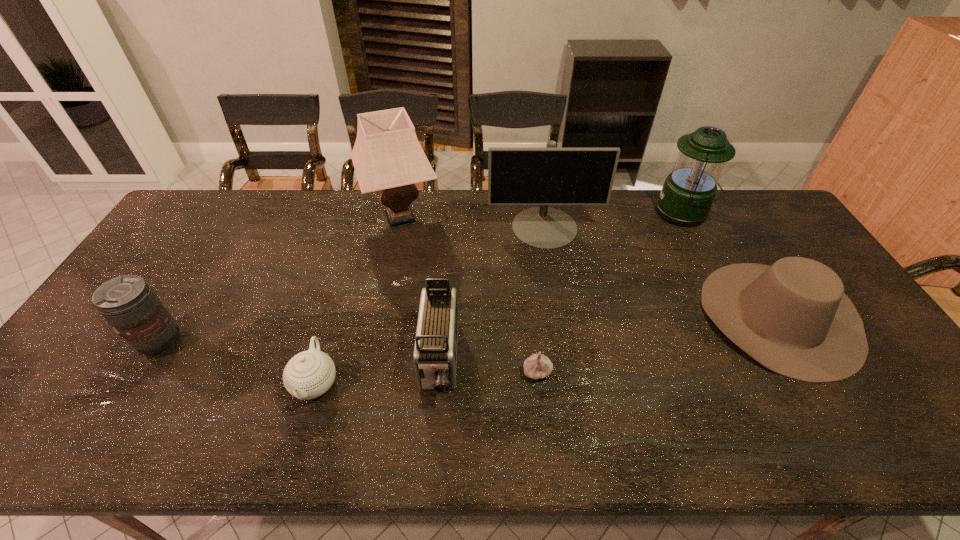
Where is `vacant space located 0.270m on the screen of the computer monitor`? The width and height of the screenshot is (960, 540). vacant space located 0.270m on the screen of the computer monitor is located at coordinates pyautogui.click(x=559, y=315).

What are the coordinates of `free space located 0.350m on the side of the telephoto lens where the control switches are located` in the screenshot? It's located at (319, 343).

Identify the location of vacant region located on the left of the sixth tallest object. The width and height of the screenshot is (960, 540). (574, 316).

Where is `vacant space located on the left of the shortest object`? The width and height of the screenshot is (960, 540). vacant space located on the left of the shortest object is located at coordinates (467, 372).

Find the location of `lampshade located at the far edge`. lampshade located at the far edge is located at coordinates (387, 157).

I want to click on lantern that is at the far edge, so [x=687, y=195].

Where is `computer monitor situated at the far edge`? computer monitor situated at the far edge is located at coordinates (546, 176).

Identify the location of object located at the left edge. click(x=128, y=303).

At what (x,y) coordinates should I click in order to perform the action: click on object situated at the right edge. Please return your answer as a coordinate pair (x, y). The width and height of the screenshot is (960, 540). Looking at the image, I should click on (793, 317).

In the image, there is a desktop. Where is `vacant space at the far edge`? This screenshot has height=540, width=960. vacant space at the far edge is located at coordinates (424, 197).